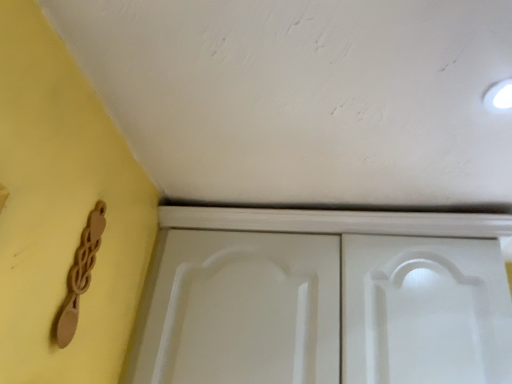
Question: From the image's perspective, is wooden spoon at lower left positioned above or below white matte cupboard at center?

Choices:
 (A) below
 (B) above

Answer: (B)

Question: Is wooden spoon at lower left wider or thinner than white matte cupboard at center?

Choices:
 (A) wide
 (B) thin

Answer: (B)

Question: From their relative heights in the image, would you say wooden spoon at lower left is taller or shorter than white matte cupboard at center?

Choices:
 (A) tall
 (B) short

Answer: (B)

Question: Is white matte cupboard at center taller or shorter than wooden spoon at lower left?

Choices:
 (A) tall
 (B) short

Answer: (A)

Question: Considering their positions, is white matte cupboard at center located in front of or behind wooden spoon at lower left?

Choices:
 (A) front
 (B) behind

Answer: (B)

Question: Looking at their shapes, would you say white matte cupboard at center is wider or thinner than wooden spoon at lower left?

Choices:
 (A) thin
 (B) wide

Answer: (B)

Question: Do you think white matte cupboard at center is within wooden spoon at lower left, or outside of it?

Choices:
 (A) inside
 (B) outside

Answer: (B)